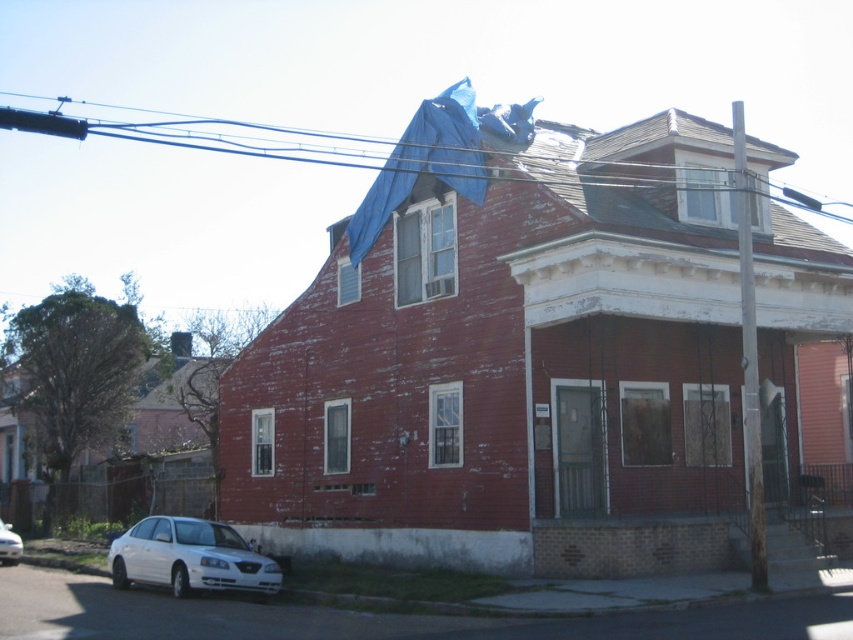
Question: Is blue plastic tarp at upper center closer to the viewer compared to white glossy sedan at lower left?

Choices:
 (A) no
 (B) yes

Answer: (B)

Question: Which point is farther to the camera?

Choices:
 (A) blue plastic tarp at upper center
 (B) white glossy sedan at lower left
 (C) white matte sedan at lower left

Answer: (B)

Question: Does white matte sedan at lower left have a lesser width compared to white glossy sedan at lower left?

Choices:
 (A) yes
 (B) no

Answer: (A)

Question: Is blue plastic tarp at upper center bigger than white matte sedan at lower left?

Choices:
 (A) no
 (B) yes

Answer: (B)

Question: Which point appears closest to the camera in this image?

Choices:
 (A) (265, 145)
 (B) (166, 536)

Answer: (B)

Question: Which object appears closest to the camera in this image?

Choices:
 (A) white glossy sedan at lower left
 (B) white matte sedan at lower left

Answer: (B)